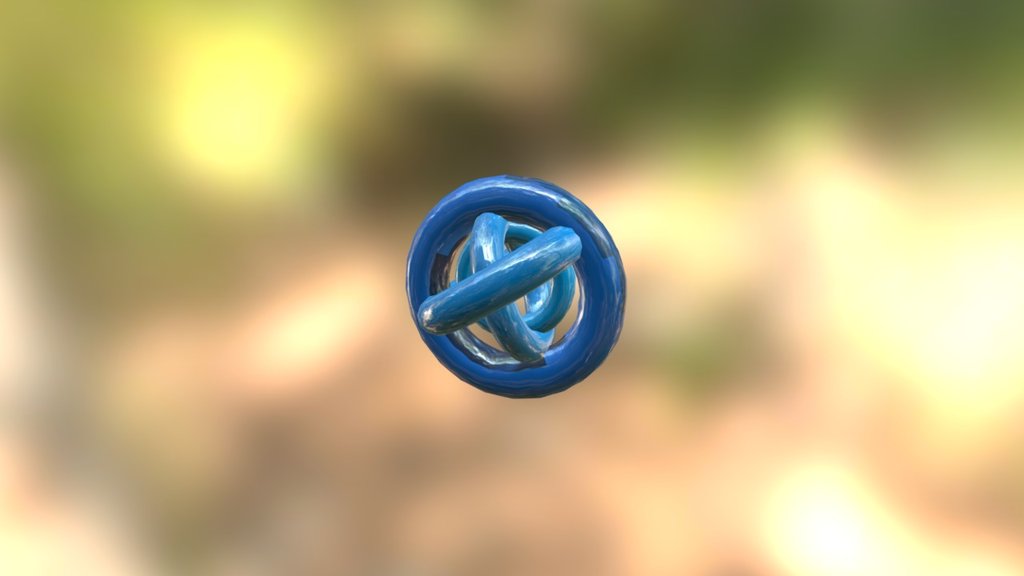
Find the location of a particular element. Image resolution: width=1024 pixels, height=576 pixels. corners is located at coordinates (992, 563), (1008, 26), (23, 563), (14, 24).